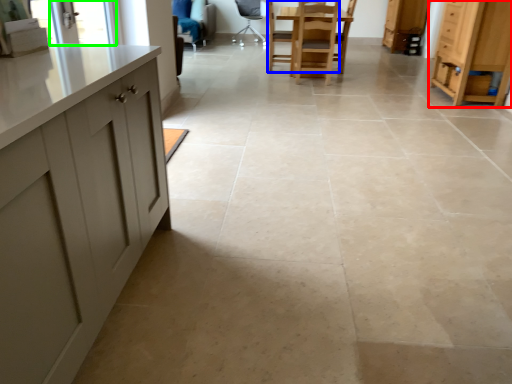
Question: Considering the real-world distances, which object is farthest from cabinetry (highlighted by a red box)? chair (highlighted by a blue box) or window screen (highlighted by a green box)?

Choices:
 (A) chair
 (B) window screen

Answer: (B)